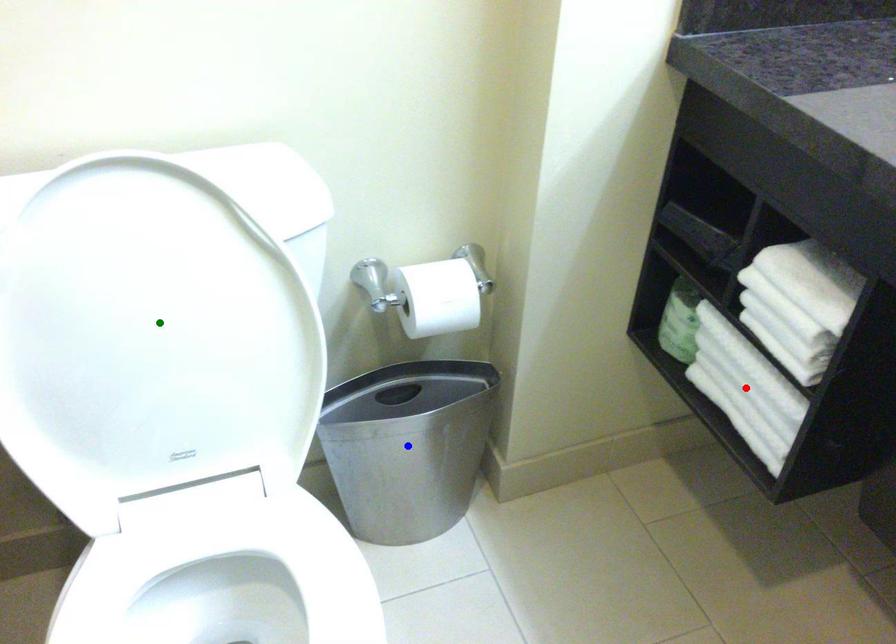
Order these from farthest to nearest:
red point | blue point | green point

blue point, red point, green point